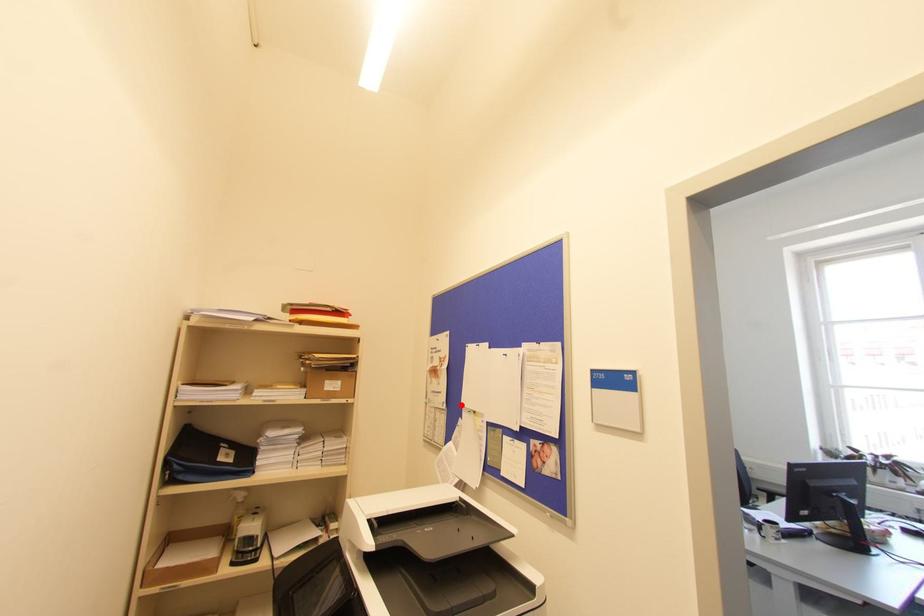
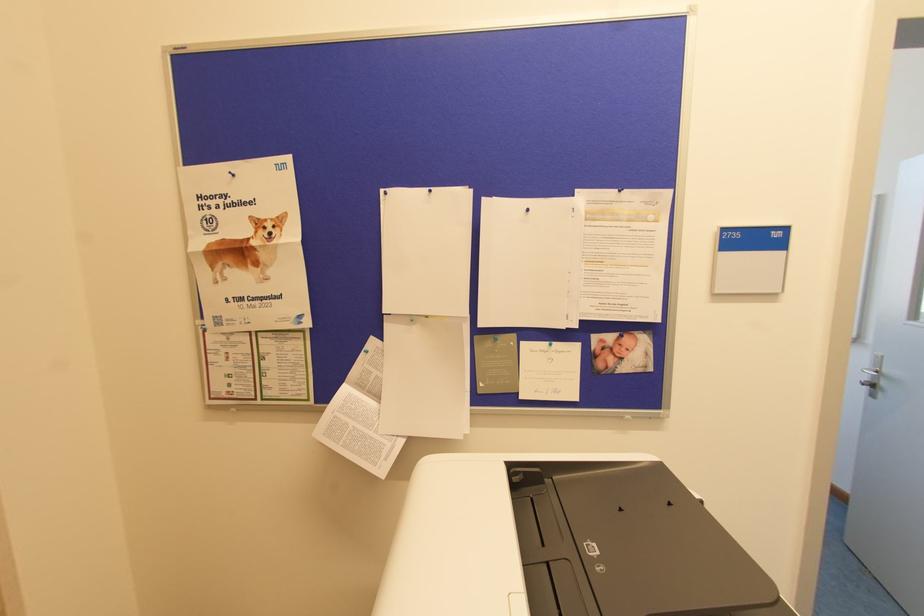
In the second image, find the point that corresponds to the highlighted location in the first image.

(383, 312)